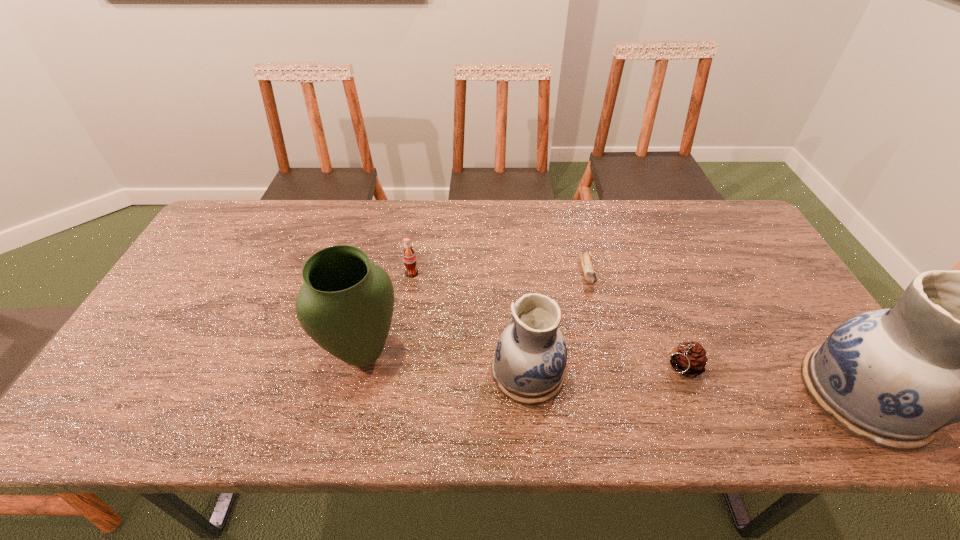
Locate an element on the screen. vacant region at the far left corner of the desktop is located at coordinates (222, 244).

This screenshot has height=540, width=960. In order to click on free space at the far right corner of the desktop in this screenshot , I will do `click(724, 201)`.

Where is `free spot between the third object from right to left and the soda`? Image resolution: width=960 pixels, height=540 pixels. free spot between the third object from right to left and the soda is located at coordinates (499, 273).

Locate an element on the screen. This screenshot has width=960, height=540. vacant area between the third tallest object and the pinecone is located at coordinates (604, 369).

Identify the location of free space that is in between the fourth tallest object and the banana. The image size is (960, 540). (499, 273).

Where is `vacant region between the pinecone and the third tallest object`? The width and height of the screenshot is (960, 540). vacant region between the pinecone and the third tallest object is located at coordinates (604, 369).

Image resolution: width=960 pixels, height=540 pixels. I want to click on empty space that is in between the banana and the third shortest object, so click(499, 273).

Locate an element on the screen. The height and width of the screenshot is (540, 960). object that ranks as the closest to the right pottery is located at coordinates (689, 359).

Choose which object is the fifth nearest neighbor to the taller pottery. Please provide its 2D coordinates. Your answer should be formatted as a tuple, i.e. [(x, y)], where the tuple contains the x and y coordinates of a point satisfying the conditions above.

[(409, 257)]

Find the location of a particular element. The image size is (960, 540). free space that satisfies the following two spatial constraints: 1. on the front side of the soda; 2. on the left side of the shorter pottery is located at coordinates (396, 372).